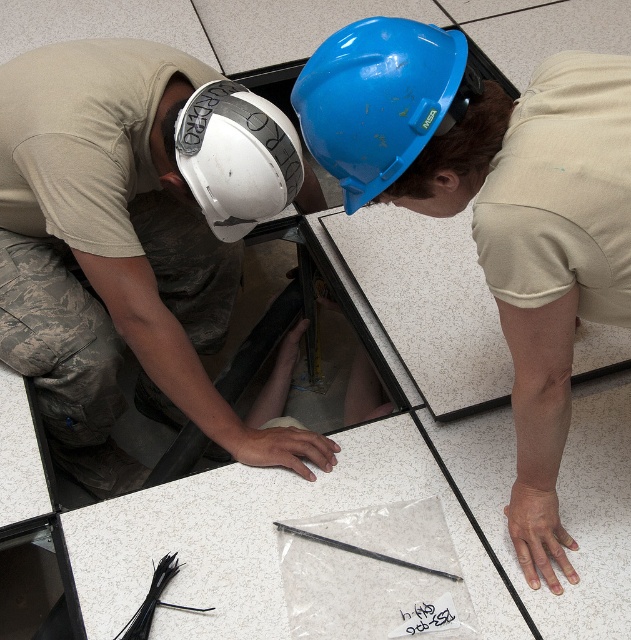
You are a safety inspector observing two workers under a raised floor panel. You see the white matte hard hat at left and the blue hard hat at center. Which worker is closer to you?

The white matte hard hat at left is closer to you because it is further to the viewer than the blue hard hat at center.

You are a worker standing at the camera position. You need to reach a tool located at point (x=533, y=540). Can you safely reach it without moving your feet?

The distance of point (x=533, y=540) from camera is 3.75 feet. If your arm length is shorter than 3.75 feet, you cannot reach it without moving your feet.

You are a safety inspector standing 1 meter away from the blue hard hat at center. Can you safely reach it without moving closer?

The blue hard hat at center is 80.86 centimeters away from the camera, which is less than 1 meter. Therefore, you can safely reach it without moving closer.